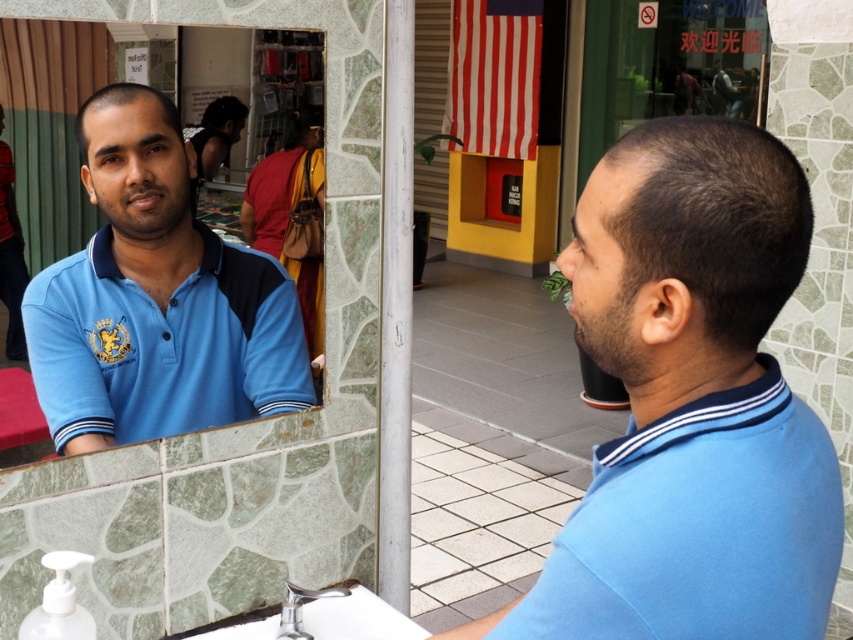
You are holding a 28 inch long pole. You need to place it horizontally from the camera to the point at point [790,490]. Will the pole reach the point?

The distance between the camera and point [790,490] is 30.95 inches. Since the pole is 28 inches long, it will not reach the point as it is 2.95 inches short.

You are a photographer setting up a shoot in this scene. You want to position a light source to the left of both the matte blue polo shirt at right and the silver metallic faucet at lower center. Is this possible given their current positions?

The matte blue polo shirt at right is to the right of the silver metallic faucet at lower center. Since the polo shirt is already positioned to the right of the faucet, placing a light source to the left of both would require positioning it to the left of the faucet, which is feasible as there is space available to the left side of both objects.